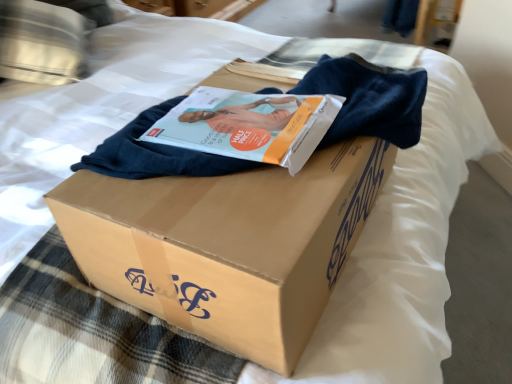
Question: Is brown cardboard box at center taller or shorter than matte paper magazine at center?

Choices:
 (A) short
 (B) tall

Answer: (B)

Question: Would you say brown cardboard box at center is to the left or to the right of matte paper magazine at center in the picture?

Choices:
 (A) left
 (B) right

Answer: (B)

Question: Which object is positioned closest to the metallic silver pillow at upper left?

Choices:
 (A) brown cardboard box at center
 (B) matte paper magazine at center

Answer: (B)

Question: Estimate the real-world distances between objects in this image. Which object is closer to the metallic silver pillow at upper left?

Choices:
 (A) brown cardboard box at center
 (B) matte paper magazine at center

Answer: (B)